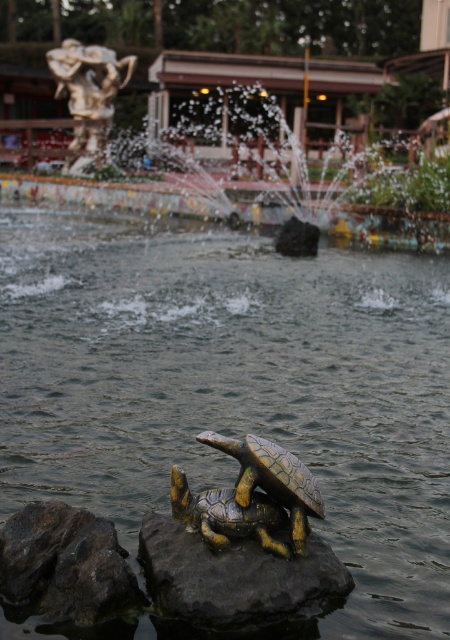
Does shiny bronze tortoise at center come behind yellow matte tortoise at center?

Yes, shiny bronze tortoise at center is behind yellow matte tortoise at center.

Is point (279, 452) farther from camera compared to point (171, 499)?

No, (279, 452) is in front of (171, 499).

At what (x,y) coordinates should I click in order to perform the action: click on shiny bronze tortoise at center. Please return your answer as a coordinate pair (x, y). Looking at the image, I should click on (273, 480).

Which of these two, dark gray stone at center or shiny bronze tortoise at center, stands shorter?

Standing shorter between the two is dark gray stone at center.

Which of these two, dark gray stone at center or shiny bronze tortoise at center, stands taller?

With more height is shiny bronze tortoise at center.

Find the location of a particular element. This screenshot has height=640, width=450. dark gray stone at center is located at coordinates (234, 577).

Based on the photo, does dark gray stone at center have a greater height compared to yellow matte tortoise at center?

No.

Is dark gray stone at center shorter than yellow matte tortoise at center?

Yes, dark gray stone at center is shorter than yellow matte tortoise at center.

Between point (189, 580) and point (219, 532), which one is positioned behind?

The point (219, 532) is more distant.

Identify the location of dark gray stone at center. The height and width of the screenshot is (640, 450). (234, 577).